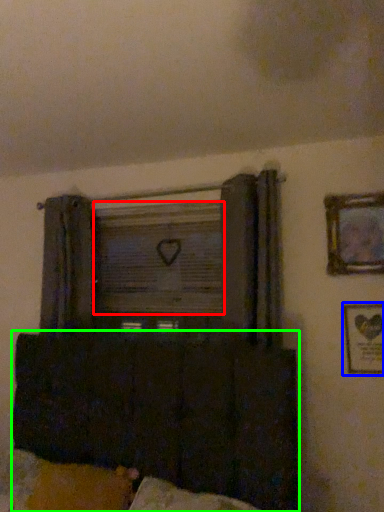
Question: Which is nearer to the window screen (highlighted by a red box)? picture frame (highlighted by a blue box) or furniture (highlighted by a green box).

Choices:
 (A) picture frame
 (B) furniture

Answer: (B)